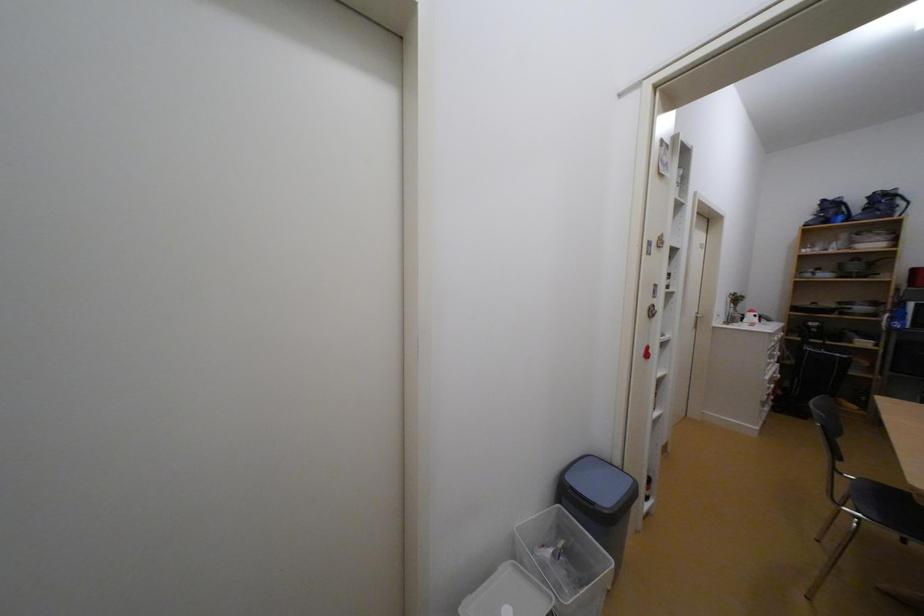
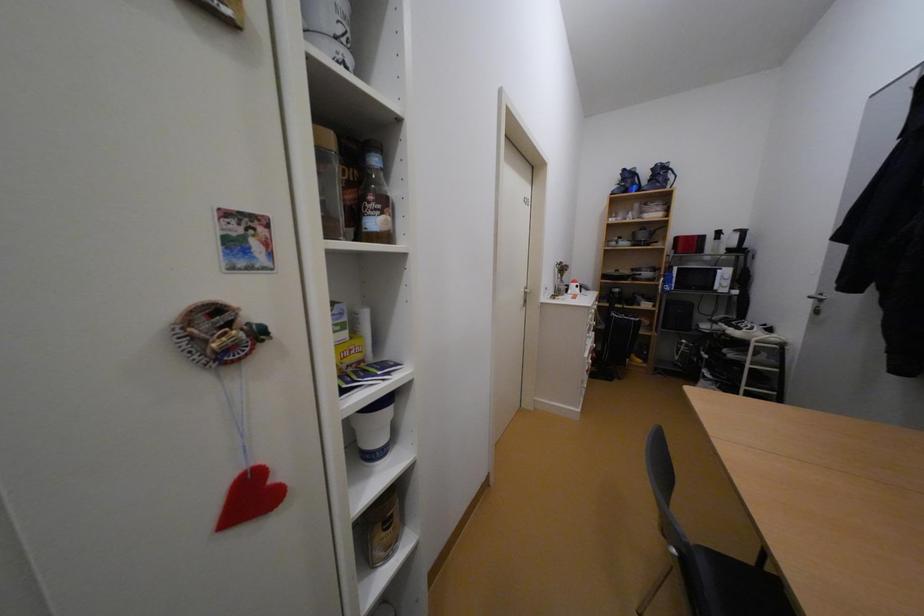
The images are taken continuously from a first-person perspective. In which direction are you moving?

The cameraman walked toward right, forward.